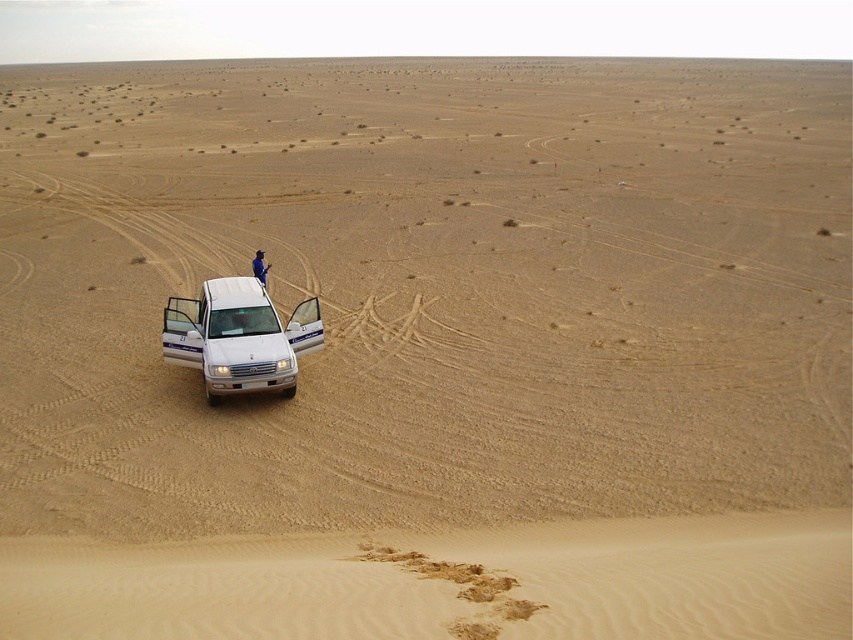
Can you confirm if white matte jeep at lower left is positioned below blue fabric person at center?

Indeed, white matte jeep at lower left is positioned under blue fabric person at center.

Is white matte jeep at lower left shorter than blue fabric person at center?

No, white matte jeep at lower left is not shorter than blue fabric person at center.

Is point (167, 353) farther from camera compared to point (254, 260)?

No, (167, 353) is closer to viewer.

Identify the location of white matte jeep at lower left. (239, 337).